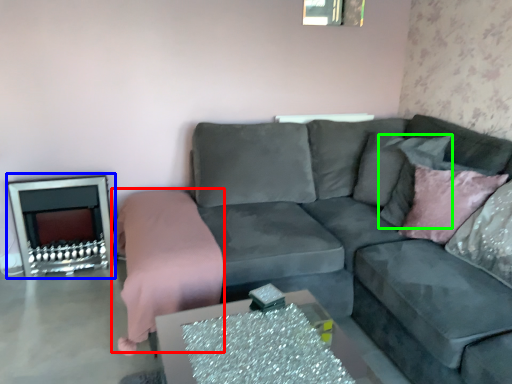
Question: Estimate the real-world distances between objects in this image. Which object is farther from bedding (highlighted by a red box), fireplace (highlighted by a blue box) or pillow (highlighted by a green box)?

Choices:
 (A) fireplace
 (B) pillow

Answer: (B)